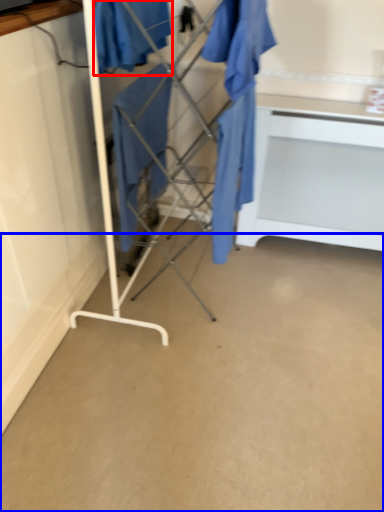
Question: Which of the following is the closest to the observer, clothing (highlighted by a red box) or concrete (highlighted by a blue box)?

Choices:
 (A) clothing
 (B) concrete

Answer: (B)